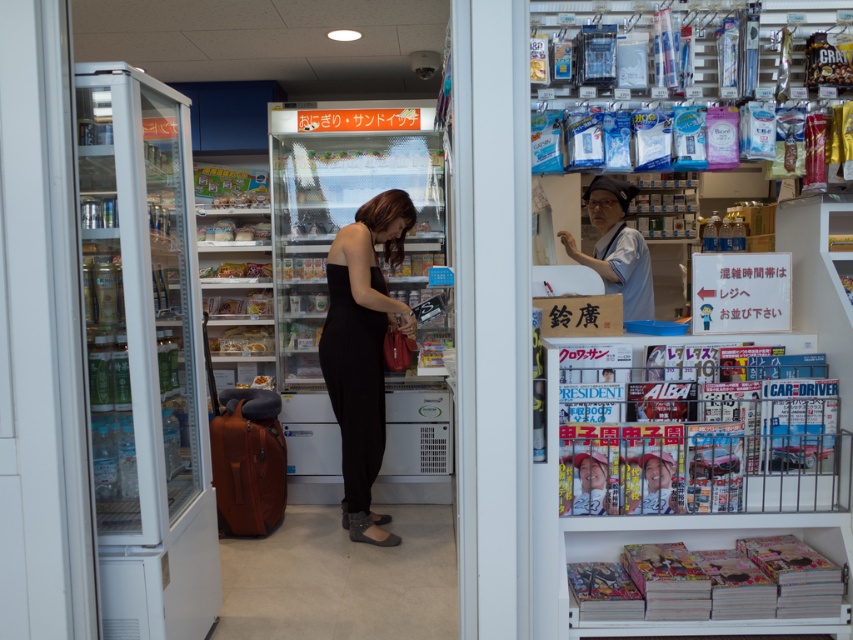
You are organizing a display in the convenience store and need to place both the soft cover manga at lower right and the matte black magazine at center on a shelf. If the shelf has limited space and you can only fit one of them, which one should you choose based on their size?

The soft cover manga at lower right is wider than the matte black magazine at center, so you should choose the soft cover manga at lower right to fit on the shelf since it takes up more space.

You are a customer in the convenience store and want to find the soft cover manga at lower right. Based on the store layout, where should you look relative to the refrigerator on the left?

The soft cover manga at lower right is located at the lower right area of the image, which is opposite to the refrigerator on the left. Since the refrigerator is on the left side, you should look towards the right side of the store to find the soft cover manga at lower right.

You are standing in a convenience store and want to take a photo of the point at coordinates (621, 216). The camera you are using has a focal length of 50mm and a sensor size of 24mm x 36mm. If the point is 4.09 meters away from the camera, what is the angle of view required to capture this point in the frame?

The angle of view required to capture the point at coordinates (621, 216), which is 4.09 meters away from the camera, can be calculated using the focal length and sensor size. However, without knowing the exact dimensions of the scene or the position of the point relative to the sensor, an exact angle cannot be determined. The question might need additional information such as the distance from the camera to the point or the sensor dimensions in relation to the scene.